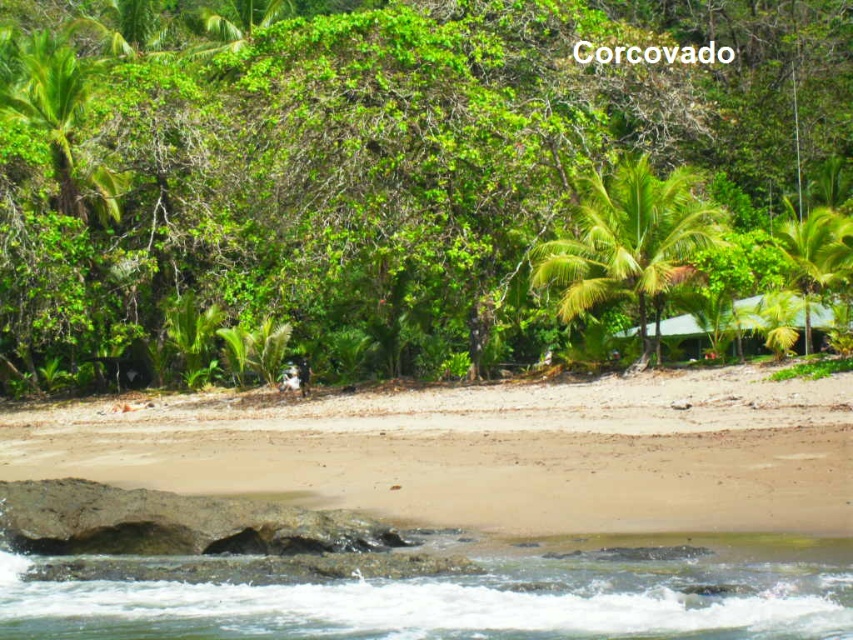
Can you confirm if beige sandy beach at lower center is positioned to the left of green leafy palm tree at right?

Correct, you'll find beige sandy beach at lower center to the left of green leafy palm tree at right.

What do you see at coordinates (492, 452) in the screenshot?
I see `beige sandy beach at lower center` at bounding box center [492, 452].

Identify the location of beige sandy beach at lower center. This screenshot has width=853, height=640. (492, 452).

From the picture: Does clear water at lower center have a smaller size compared to green leafy palm tree at right?

Yes, clear water at lower center is smaller than green leafy palm tree at right.

Between clear water at lower center and green leafy palm tree at right, which one is positioned higher?

green leafy palm tree at right

What are the coordinates of `clear water at lower center` in the screenshot? It's located at (453, 595).

The image size is (853, 640). Identify the location of clear water at lower center. (453, 595).

Can you confirm if beige sandy beach at lower center is shorter than clear water at lower center?

Incorrect, beige sandy beach at lower center's height does not fall short of clear water at lower center's.

Image resolution: width=853 pixels, height=640 pixels. What do you see at coordinates (492, 452) in the screenshot?
I see `beige sandy beach at lower center` at bounding box center [492, 452].

Measure the distance between point (x=630, y=412) and camera.

A distance of 20.20 meters exists between point (x=630, y=412) and camera.

The width and height of the screenshot is (853, 640). What are the coordinates of `beige sandy beach at lower center` in the screenshot? It's located at (492, 452).